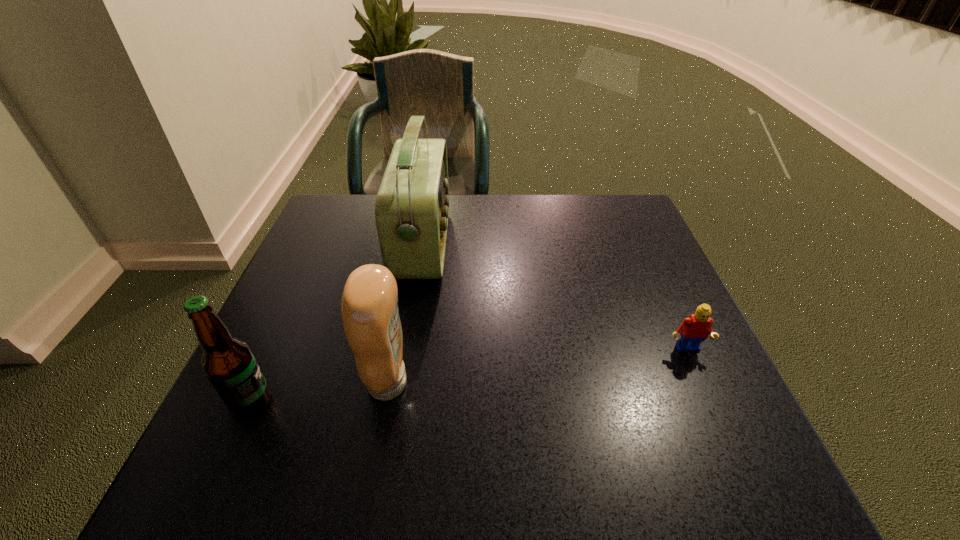
This screenshot has height=540, width=960. Identify the location of the tallest object. (412, 204).

The height and width of the screenshot is (540, 960). Identify the location of the farthest object. (412, 204).

Identify the location of condiment. The height and width of the screenshot is (540, 960). (369, 304).

Find the location of a particular element. Image resolution: width=960 pixels, height=540 pixels. beer bottle is located at coordinates (228, 362).

The height and width of the screenshot is (540, 960). In order to click on the rightmost object in this screenshot , I will do `click(695, 329)`.

Locate an element on the screen. This screenshot has width=960, height=540. Lego is located at coordinates [695, 329].

Locate an element on the screen. The height and width of the screenshot is (540, 960). vacant space located 0.250m on the front panel of the tallest object is located at coordinates (544, 244).

Identify the location of vacant space located 0.140m on the label of the condiment. (485, 383).

Image resolution: width=960 pixels, height=540 pixels. I want to click on free point located 0.140m on the label of the leftmost object, so click(349, 402).

Where is `free point located on the front-facing side of the rightmost object`? The height and width of the screenshot is (540, 960). free point located on the front-facing side of the rightmost object is located at coordinates (703, 388).